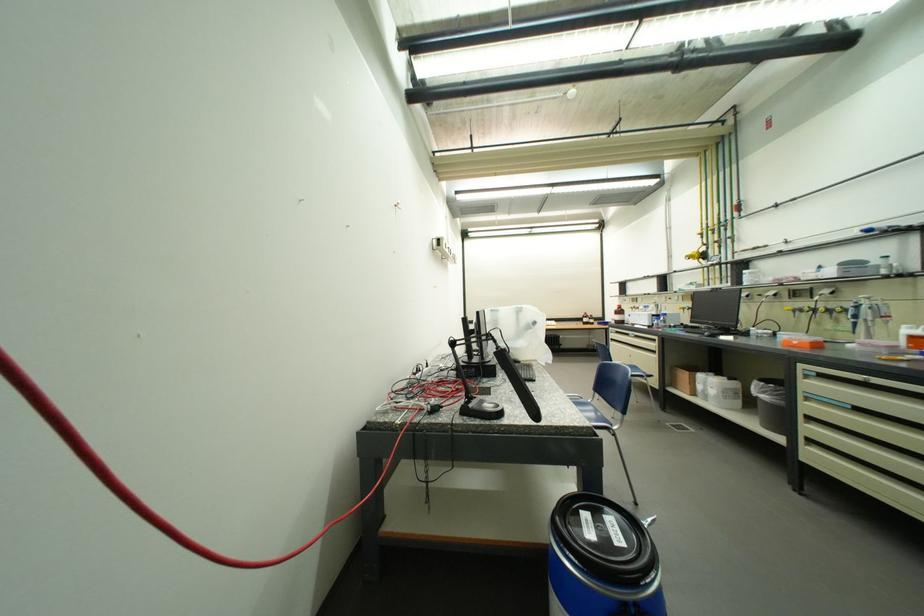
I want to click on black barrel lid, so click(x=606, y=533).